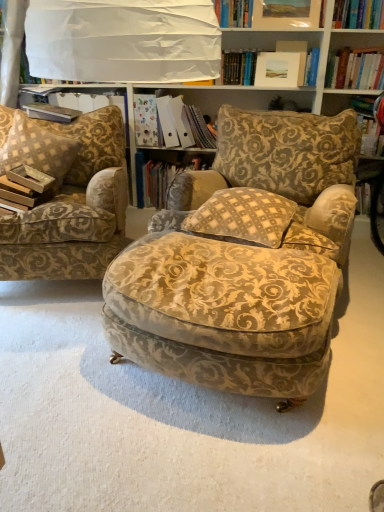
Question: From the image's perspective, is velvet gold-patterned ottoman at center, which is counted as the first chair, starting from the right, located above or below gold-patterned fabric armchair at left, placed as the 1th chair when sorted from left to right?

Choices:
 (A) below
 (B) above

Answer: (A)

Question: From a real-world perspective, is velvet gold-patterned ottoman at center, which is counted as the first chair, starting from the right, above or below gold-patterned fabric armchair at left, placed as the 1th chair when sorted from left to right?

Choices:
 (A) above
 (B) below

Answer: (B)

Question: Estimate the real-world distances between objects in this image. Which object is farther from the hardcover book at upper left?

Choices:
 (A) velvet gold-patterned ottoman at center, which is counted as the first chair, starting from the right
 (B) matte paper folder at center, acting as the 1th book starting from the top
 (C) gold-patterned fabric armchair at left, positioned as the 2th chair in right-to-left order
 (D) beige textured pillow at left, the 1th pillow positioned from the back
 (E) beige checkered pillow at center, the 1th pillow when ordered from front to back

Answer: (A)

Question: Which is farther from the beige textured pillow at left, the first pillow when ordered from left to right?

Choices:
 (A) matte paper folder at center, acting as the 1th book starting from the top
 (B) velvet gold-patterned ottoman at center, the 2th chair viewed from the left
 (C) hardcover book at center, positioned as the 2th book in top-to-bottom order
 (D) matte white picture frame at upper center
 (E) gold-patterned fabric armchair at left, positioned as the 2th chair in right-to-left order

Answer: (D)